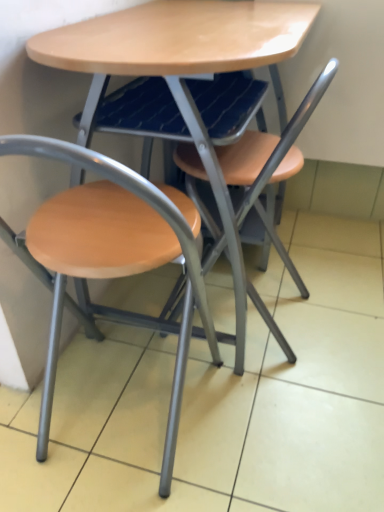
The height and width of the screenshot is (512, 384). What are the coordinates of `matte wood table at center` in the screenshot? It's located at (181, 73).

This screenshot has width=384, height=512. Describe the element at coordinates (251, 197) in the screenshot. I see `wooden seat at center, positioned as the first chair in right-to-left order` at that location.

This screenshot has width=384, height=512. What do you see at coordinates (115, 255) in the screenshot?
I see `matte wood chair at left, which is counted as the second chair, starting from the right` at bounding box center [115, 255].

At what (x,y) coordinates should I click in order to perform the action: click on matte wood table at center. Please return your answer as a coordinate pair (x, y). Looking at the image, I should click on (181, 73).

From a real-world perspective, does wooden seat at center, positioned as the first chair in right-to-left order, sit lower than matte wood table at center?

Correct, in the physical world, wooden seat at center, positioned as the first chair in right-to-left order, is lower than matte wood table at center.

Looking at this image, considering the relative sizes of wooden seat at center, acting as the second chair starting from the left, and matte wood table at center in the image provided, is wooden seat at center, acting as the second chair starting from the left, thinner than matte wood table at center?

Indeed, wooden seat at center, acting as the second chair starting from the left, has a lesser width compared to matte wood table at center.

Does wooden seat at center, acting as the second chair starting from the left, turn towards matte wood table at center?

Yes, wooden seat at center, acting as the second chair starting from the left, faces towards matte wood table at center.

From a real-world perspective, count 1st chairs downward from the matte wood table at center and point to it. Please provide its 2D coordinates.

[(251, 197)]

From a real-world perspective, between wooden seat at center, positioned as the first chair in right-to-left order, and matte wood chair at left, marked as the first chair in a left-to-right arrangement, who is vertically lower?

In real-world perspective, matte wood chair at left, marked as the first chair in a left-to-right arrangement, is lower.

Which object is further away from the camera taking this photo, wooden seat at center, positioned as the first chair in right-to-left order, or matte wood chair at left, marked as the first chair in a left-to-right arrangement?

wooden seat at center, positioned as the first chair in right-to-left order, is more distant.

Does wooden seat at center, acting as the second chair starting from the left, have a greater width compared to matte wood chair at left, which is counted as the second chair, starting from the right?

No, wooden seat at center, acting as the second chair starting from the left, is not wider than matte wood chair at left, which is counted as the second chair, starting from the right.

Which point is more distant from viewer, (269,230) or (188,279)?

The point (269,230) is more distant.

Between matte wood table at center and wooden seat at center, acting as the second chair starting from the left, which one has larger size?

matte wood table at center.

Would you say matte wood table at center is inside or outside wooden seat at center, acting as the second chair starting from the left?

The correct answer is: outside.

Which object is closer to the camera taking this photo, matte wood table at center or wooden seat at center, acting as the second chair starting from the left?

matte wood table at center.

Is point (248, 288) farther from viewer compared to point (216, 238)?

Yes, point (248, 288) is behind point (216, 238).

Which object is thinner, matte wood chair at left, which is counted as the second chair, starting from the right, or matte wood table at center?

matte wood chair at left, which is counted as the second chair, starting from the right.

Consider the image. What's the angular difference between matte wood chair at left, which is counted as the second chair, starting from the right, and matte wood table at center's facing directions?

There is a 91-degree angle between the facing directions of matte wood chair at left, which is counted as the second chair, starting from the right, and matte wood table at center.

Can you confirm if matte wood chair at left, marked as the first chair in a left-to-right arrangement, is positioned to the left of matte wood table at center?

Yes, matte wood chair at left, marked as the first chair in a left-to-right arrangement, is to the left of matte wood table at center.

Considering the sizes of matte wood chair at left, which is counted as the second chair, starting from the right, and wooden seat at center, acting as the second chair starting from the left, in the image, is matte wood chair at left, which is counted as the second chair, starting from the right, bigger or smaller than wooden seat at center, acting as the second chair starting from the left,?

In the image, matte wood chair at left, which is counted as the second chair, starting from the right, appears to be smaller than wooden seat at center, acting as the second chair starting from the left.

Considering the sizes of objects matte wood chair at left, marked as the first chair in a left-to-right arrangement, and wooden seat at center, acting as the second chair starting from the left, in the image provided, who is thinner, matte wood chair at left, marked as the first chair in a left-to-right arrangement, or wooden seat at center, acting as the second chair starting from the left,?

Thinner between the two is wooden seat at center, acting as the second chair starting from the left.

Between matte wood chair at left, marked as the first chair in a left-to-right arrangement, and wooden seat at center, positioned as the first chair in right-to-left order, which one is positioned behind?

wooden seat at center, positioned as the first chair in right-to-left order, is further from the camera.

What's the angular difference between matte wood table at center and matte wood chair at left, marked as the first chair in a left-to-right arrangement,'s facing directions?

They differ by 91 degrees in their facing directions.

From the image's perspective, which is above, matte wood table at center or matte wood chair at left, which is counted as the second chair, starting from the right?

matte wood table at center appears higher in the image.

Between matte wood table at center and matte wood chair at left, marked as the first chair in a left-to-right arrangement, which one has smaller size?

matte wood chair at left, marked as the first chair in a left-to-right arrangement.

Who is more distant, matte wood table at center or matte wood chair at left, which is counted as the second chair, starting from the right?

matte wood table at center is further from the camera.

At what (x,y) coordinates should I click in order to perform the action: click on the 1st chair positioned below the matte wood table at center (from the image's perspective). Please return your answer as a coordinate pair (x, y). Looking at the image, I should click on (251, 197).

You are a GUI agent. You are given a task and a screenshot of the screen. Output one action in this format:
    pyautogui.click(x=<x>, y=<y>)
    Task: Click on the chair in front of the wooden seat at center, positioned as the first chair in right-to-left order
    
    Given the screenshot: What is the action you would take?
    pyautogui.click(x=115, y=255)

Estimate the real-world distances between objects in this image. Which object is closer to matte wood table at center, wooden seat at center, positioned as the first chair in right-to-left order, or matte wood chair at left, which is counted as the second chair, starting from the right?

wooden seat at center, positioned as the first chair in right-to-left order, is closer to matte wood table at center.

Estimate the real-world distances between objects in this image. Which object is closer to wooden seat at center, acting as the second chair starting from the left, matte wood chair at left, marked as the first chair in a left-to-right arrangement, or matte wood table at center?

Among the two, matte wood table at center is located nearer to wooden seat at center, acting as the second chair starting from the left.

Considering their positions, is matte wood table at center positioned further to wooden seat at center, positioned as the first chair in right-to-left order, than matte wood chair at left, marked as the first chair in a left-to-right arrangement?

matte wood chair at left, marked as the first chair in a left-to-right arrangement, is positioned further to the anchor wooden seat at center, positioned as the first chair in right-to-left order.

From the image, which object appears to be farther from matte wood table at center, matte wood chair at left, marked as the first chair in a left-to-right arrangement, or wooden seat at center, acting as the second chair starting from the left?

matte wood chair at left, marked as the first chair in a left-to-right arrangement, is positioned further to the anchor matte wood table at center.

Based on their spatial positions, is wooden seat at center, positioned as the first chair in right-to-left order, or matte wood table at center closer to matte wood chair at left, marked as the first chair in a left-to-right arrangement?

Based on the image, wooden seat at center, positioned as the first chair in right-to-left order, appears to be nearer to matte wood chair at left, marked as the first chair in a left-to-right arrangement.

Considering their positions, is matte wood table at center positioned further to matte wood chair at left, marked as the first chair in a left-to-right arrangement, than wooden seat at center, acting as the second chair starting from the left?

matte wood table at center is further to matte wood chair at left, marked as the first chair in a left-to-right arrangement.

Find the location of a particular element. chair between matte wood table at center and matte wood chair at left, marked as the first chair in a left-to-right arrangement, from top to bottom is located at coordinates (251, 197).